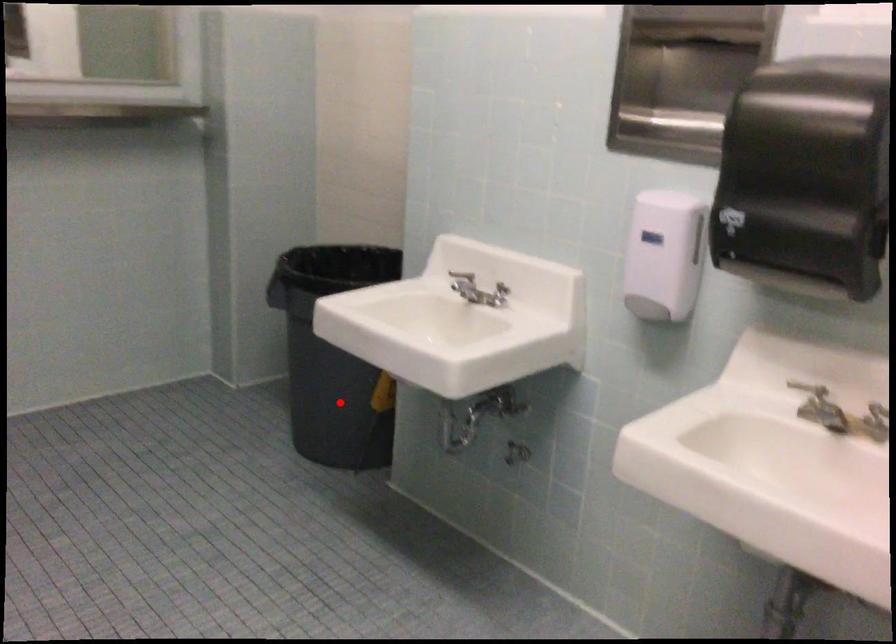
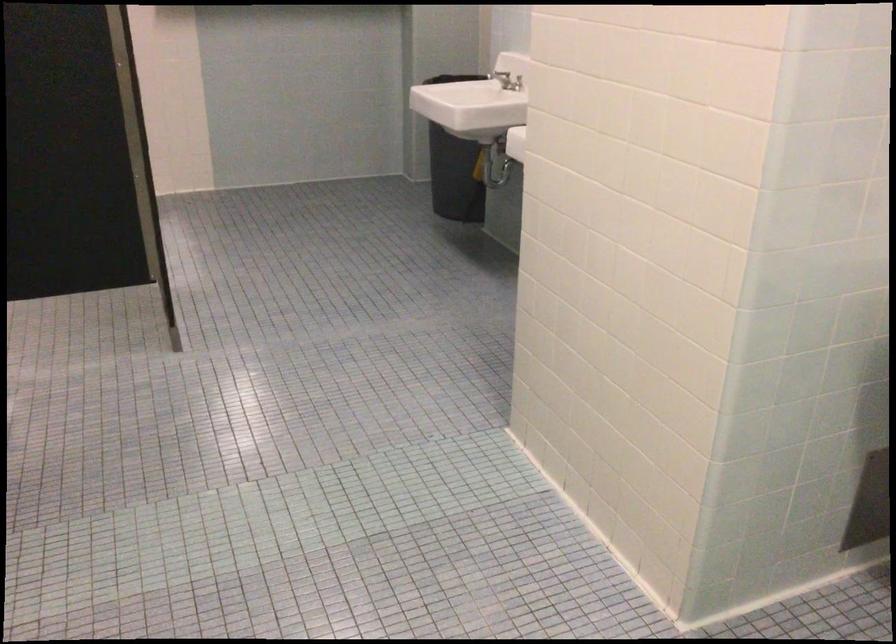
Locate, in the second image, the point that corresponds to the highlighted location in the first image.

(453, 167)